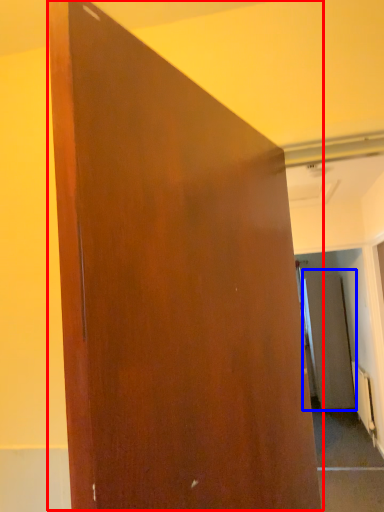
Question: Which object is closer to the camera taking this photo, door (highlighted by a red box) or screen door (highlighted by a blue box)?

Choices:
 (A) door
 (B) screen door

Answer: (A)